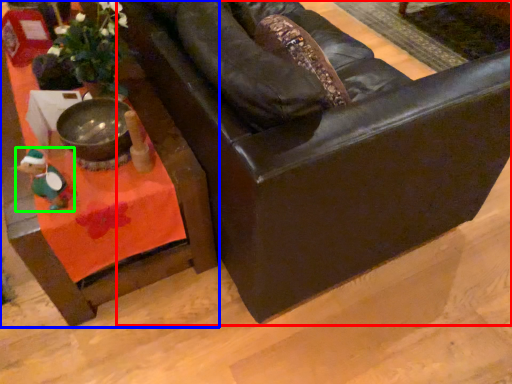
Question: Which object is the farthest from chair (highlighted by a red box)? Choose among these: table (highlighted by a blue box) or toy (highlighted by a green box).

Choices:
 (A) table
 (B) toy

Answer: (B)